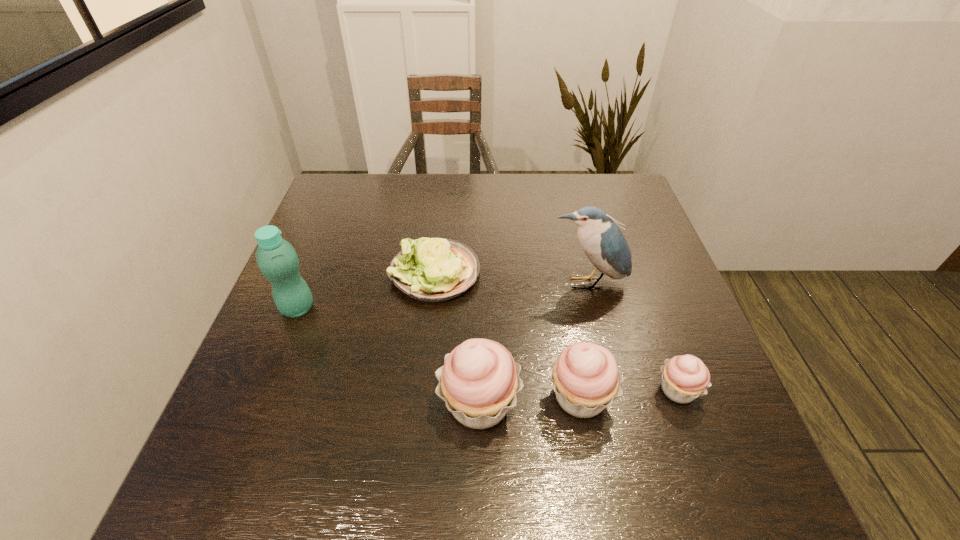
Where is `vacant space that satisfies the following two spatial constraints: 1. at the tip of the bird's beak; 2. at the front cap of the water bottle`? Image resolution: width=960 pixels, height=540 pixels. vacant space that satisfies the following two spatial constraints: 1. at the tip of the bird's beak; 2. at the front cap of the water bottle is located at coordinates (593, 308).

The image size is (960, 540). In order to click on free space in the image that satisfies the following two spatial constraints: 1. at the front cap of the leftmost object; 2. on the left side of the second shortest object in this screenshot , I will do `click(265, 390)`.

In order to click on vacant space that satisfies the following two spatial constraints: 1. at the tip of the bird's beak; 2. on the left side of the shortest cupcake in this screenshot , I will do `click(613, 390)`.

The height and width of the screenshot is (540, 960). What are the coordinates of `free space that satisfies the following two spatial constraints: 1. on the front side of the shortest object; 2. on the right side of the rightmost cupcake` in the screenshot? It's located at (422, 390).